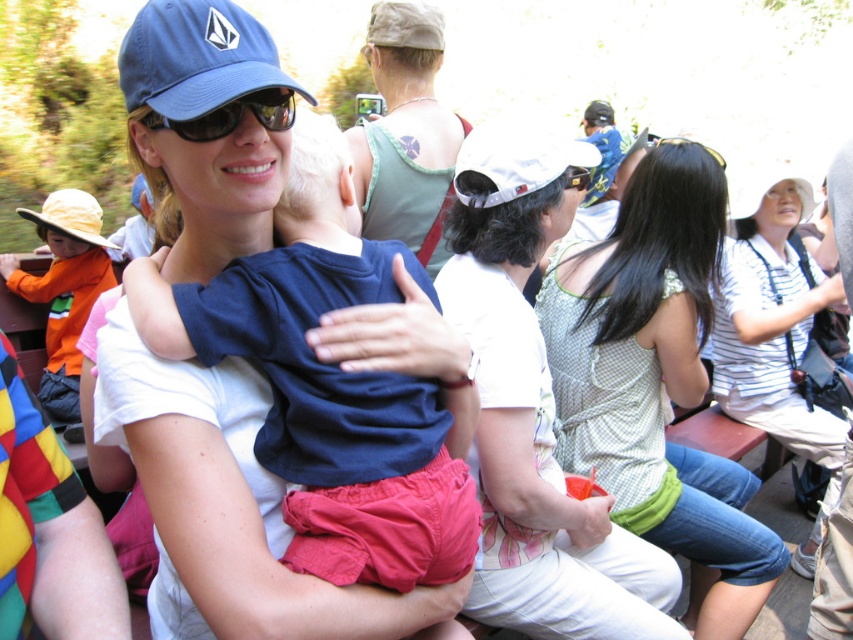
You are a photographer trying to capture a photo of the blue fabric baseball cap at upper left and the black plastic goggles at upper center. Which object should you adjust your camera focus to first if you want to ensure both are in focus, considering their positions?

The blue fabric baseball cap at upper left is positioned on the left side of black plastic goggles at upper center. Since they are at different distances from the camera, you should focus on the closer object first. However, the description does not specify which is closer, so you might need to adjust focus between both to ensure clarity.

You are a photographer trying to capture a clear shot of both the blue fabric baseball cap at upper left and the black plastic goggles at upper center. Since you want both items to be visible in your photo, which object should you focus on first to ensure it doesn not get cropped out?

The blue fabric baseball cap at upper left is taller than the black plastic goggles at upper center, so you should focus on the blue fabric baseball cap at upper left first to ensure it doesn not get cropped out due to its greater height.

Looking at this image, you are an observer at the park. You notice two items in the scene described in the image. The first is an orange cotton shirt at left, and the second is a black reflective sunglasses at center. Which of these two items is bigger in size?

The orange cotton shirt at left is larger in size than the black reflective sunglasses at center.